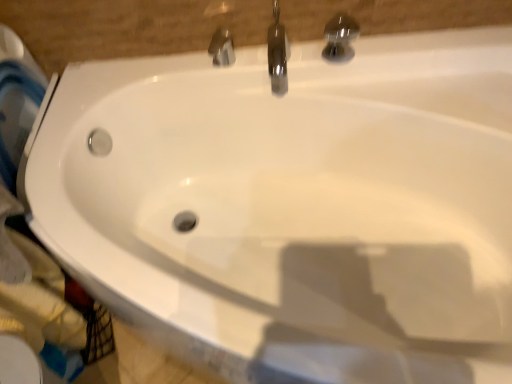
Question: Is polished chrome faucet at upper center, which is counted as the second tap, starting from the left, to the right of polished chrome tap at upper center, the third tap when ordered from left to right, from the viewer's perspective?

Choices:
 (A) no
 (B) yes

Answer: (A)

Question: From a real-world perspective, is polished chrome faucet at upper center, which is the second tap from right to left, positioned under polished chrome tap at upper center, the third tap when ordered from left to right, based on gravity?

Choices:
 (A) no
 (B) yes

Answer: (B)

Question: Is polished chrome faucet at upper center, which is counted as the second tap, starting from the left, with polished chrome tap at upper center, the first tap positioned from the right?

Choices:
 (A) no
 (B) yes

Answer: (A)

Question: Does polished chrome faucet at upper center, which is the second tap from right to left, have a greater width compared to polished chrome tap at upper center, the third tap when ordered from left to right?

Choices:
 (A) no
 (B) yes

Answer: (B)

Question: From a real-world perspective, is polished chrome faucet at upper center, which is the second tap from right to left, over polished chrome tap at upper center, the first tap positioned from the right?

Choices:
 (A) yes
 (B) no

Answer: (B)

Question: Considering the relative sizes of polished chrome faucet at upper center, which is counted as the second tap, starting from the left, and polished chrome tap at upper center, the first tap positioned from the right, in the image provided, is polished chrome faucet at upper center, which is counted as the second tap, starting from the left, taller than polished chrome tap at upper center, the first tap positioned from the right,?

Choices:
 (A) yes
 (B) no

Answer: (B)

Question: Considering the relative positions of polished chrome faucet at upper center, which is counted as the second tap, starting from the left, and polished chrome faucet at upper center, which ranks as the 3th tap in right-to-left order, in the image provided, is polished chrome faucet at upper center, which is counted as the second tap, starting from the left, in front of polished chrome faucet at upper center, which ranks as the 3th tap in right-to-left order,?

Choices:
 (A) no
 (B) yes

Answer: (B)

Question: Can you confirm if polished chrome faucet at upper center, which is the second tap from right to left, is bigger than polished chrome faucet at upper center, which ranks as the first tap in left-to-right order?

Choices:
 (A) yes
 (B) no

Answer: (A)

Question: Could you tell me if polished chrome faucet at upper center, which is the second tap from right to left, is facing polished chrome faucet at upper center, which ranks as the 3th tap in right-to-left order?

Choices:
 (A) yes
 (B) no

Answer: (B)

Question: From a real-world perspective, is polished chrome faucet at upper center, which is the second tap from right to left, on polished chrome faucet at upper center, which ranks as the first tap in left-to-right order?

Choices:
 (A) no
 (B) yes

Answer: (B)

Question: Is polished chrome faucet at upper center, which is the second tap from right to left, oriented away from polished chrome faucet at upper center, which ranks as the 3th tap in right-to-left order?

Choices:
 (A) yes
 (B) no

Answer: (B)

Question: Is polished chrome faucet at upper center, which is the second tap from right to left, thinner than polished chrome faucet at upper center, which ranks as the 3th tap in right-to-left order?

Choices:
 (A) yes
 (B) no

Answer: (B)

Question: Does polished chrome faucet at upper center, which ranks as the first tap in left-to-right order, touch polished chrome faucet at upper center, which is the second tap from right to left?

Choices:
 (A) yes
 (B) no

Answer: (B)